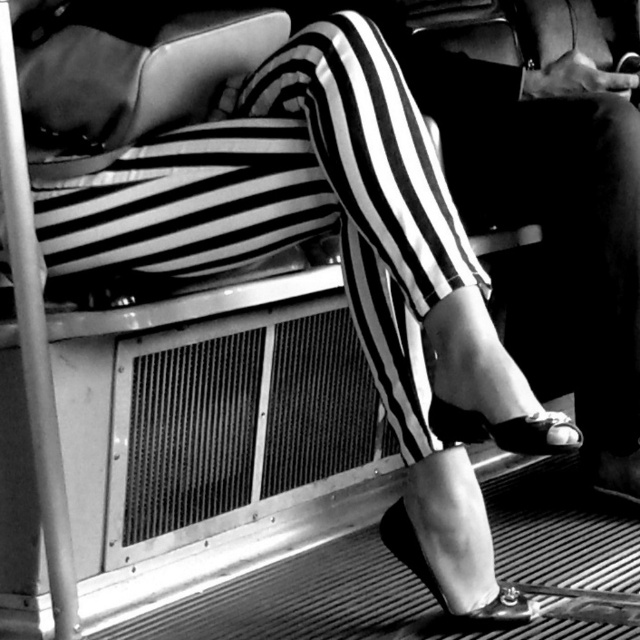
Question: Which of the following is the farthest from the observer?

Choices:
 (A) pos(448,435)
 (B) pos(435,582)

Answer: (B)

Question: Can you confirm if shiny black sandal at lower center is smaller than shiny black sandal at lower right?

Choices:
 (A) no
 (B) yes

Answer: (A)

Question: Can you confirm if shiny black sandal at lower center is bigger than shiny black sandal at lower right?

Choices:
 (A) no
 (B) yes

Answer: (B)

Question: Which object is positioned closest to the shiny patent leather sandal at lower center?

Choices:
 (A) shiny black sandal at lower right
 (B) shiny black sandal at lower center

Answer: (B)

Question: Which of the following is the closest to the observer?

Choices:
 (A) shiny black sandal at lower right
 (B) shiny patent leather sandal at lower center
 (C) shiny black sandal at lower center

Answer: (C)

Question: Does shiny black sandal at lower center appear on the left side of shiny patent leather sandal at lower center?

Choices:
 (A) no
 (B) yes

Answer: (A)